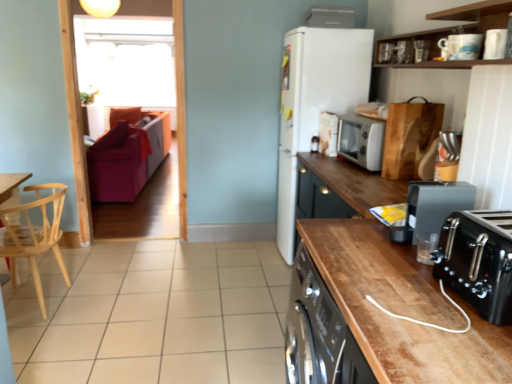
At what (x,y) coordinates should I click in order to perform the action: click on free space above black wood countertop at lower right (from a real-world perspective). Please return your answer as a coordinate pair (x, y). Looking at the image, I should click on (382, 253).